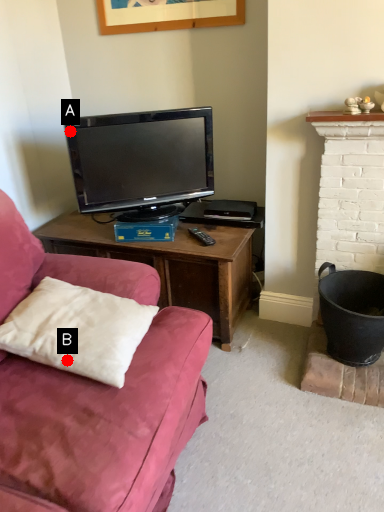
Question: Two points are circled on the image, labeled by A and B beside each circle. Which point is farther from the camera taking this photo?

Choices:
 (A) A is further
 (B) B is further

Answer: (A)